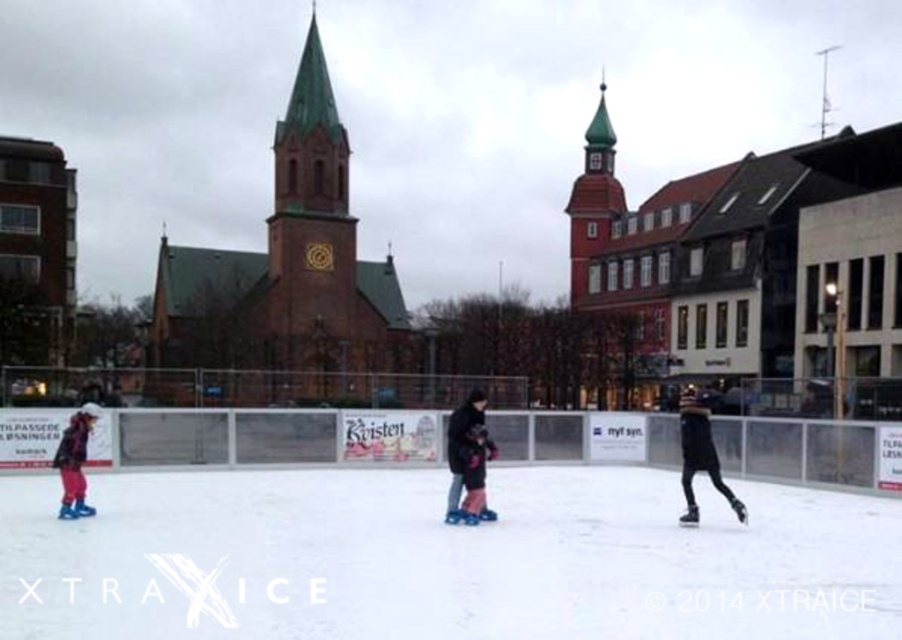
You are an ice skater trying to avoid collisions on the rink. You see the dark blue fabric jacket at center and the matte pink pants at left. Which one has a wider silhouette when viewed from above?

The matte pink pants at left has a wider silhouette than the dark blue fabric jacket at center.

You are an ice skater standing at the edge of the rink. You see the white smooth ice at center and the dark blue fabric jacket at center. Which object is closer to you?

The white smooth ice at center is closer to the viewer than the dark blue fabric jacket at center.

You are standing at the camera position and want to reach point (688,596). Can you walk directly to it without any obstacles?

The distance between the camera and point (688,596) is 148.31 feet, so yes, you can walk directly to it since there are no obstacles mentioned in the scene description.